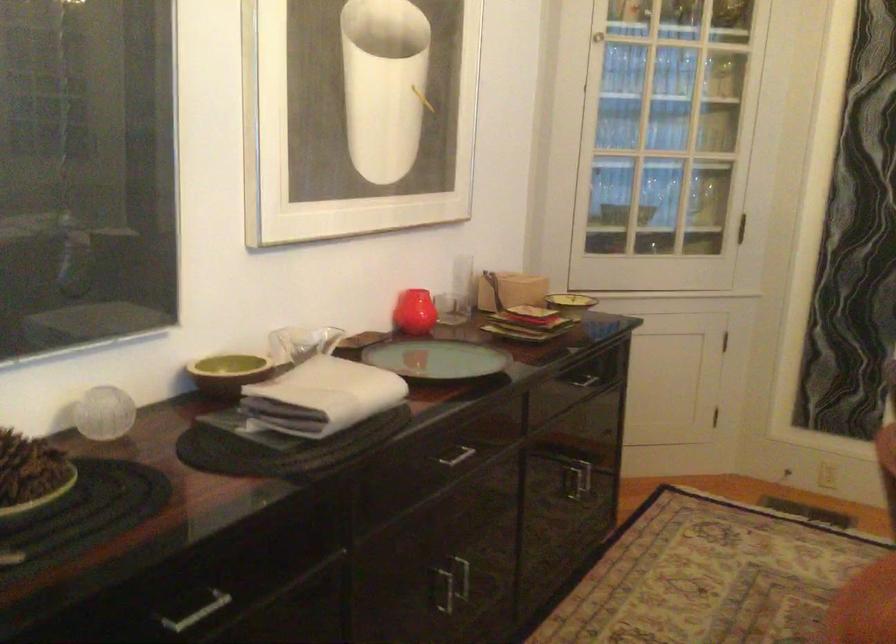
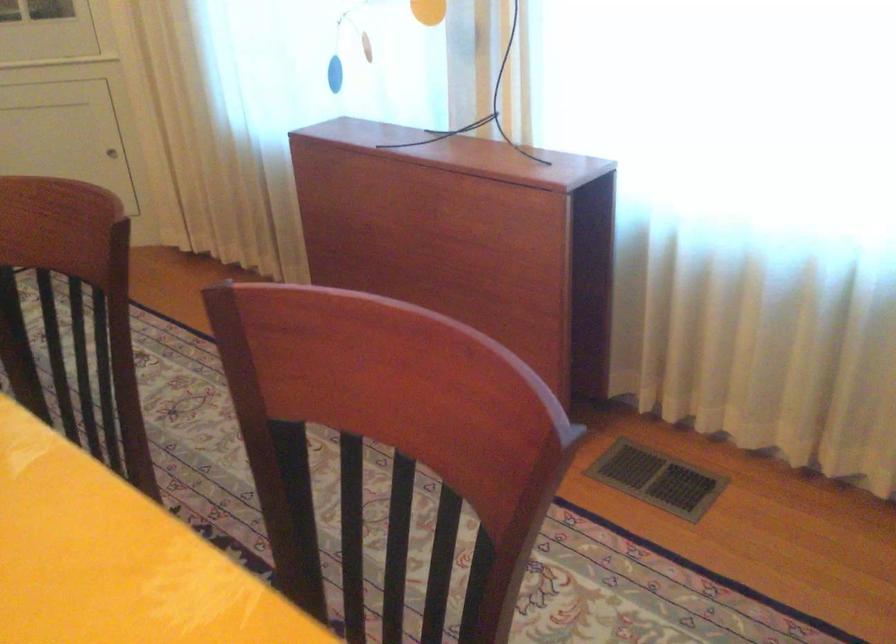
Based on the continuous images, in which direction is the camera rotating?

The camera's rotation is toward right-down.